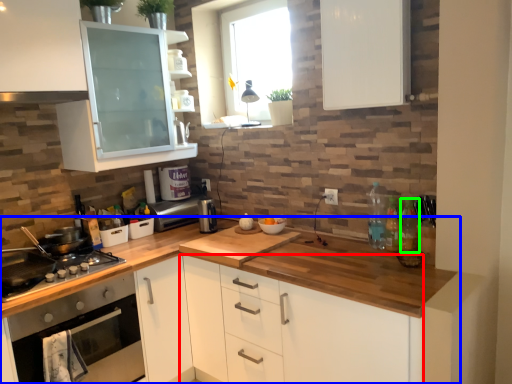
Question: Which object is positioned closest to cabinetry (highlighted by a red box)? Select from countertop (highlighted by a blue box) and bottle (highlighted by a green box).

Choices:
 (A) countertop
 (B) bottle

Answer: (A)